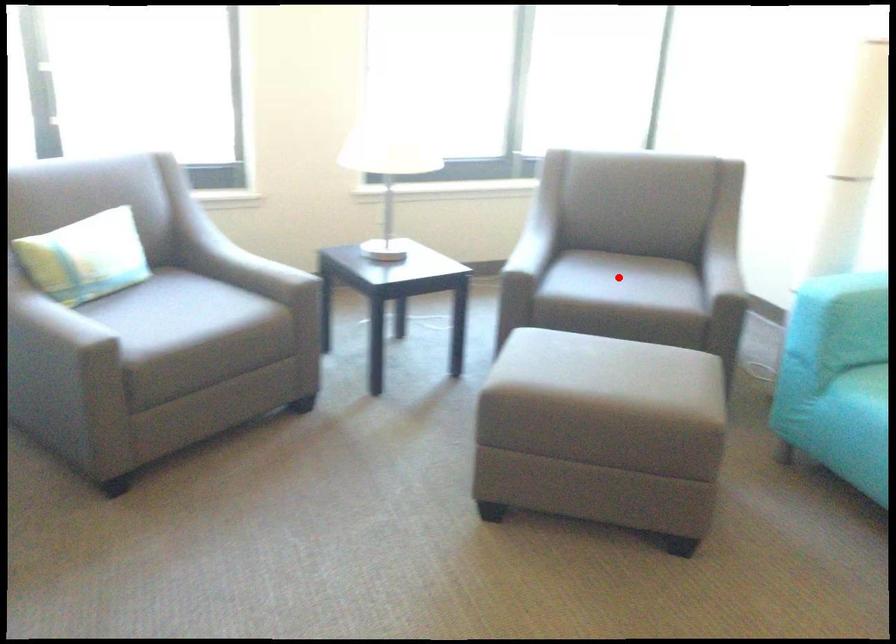
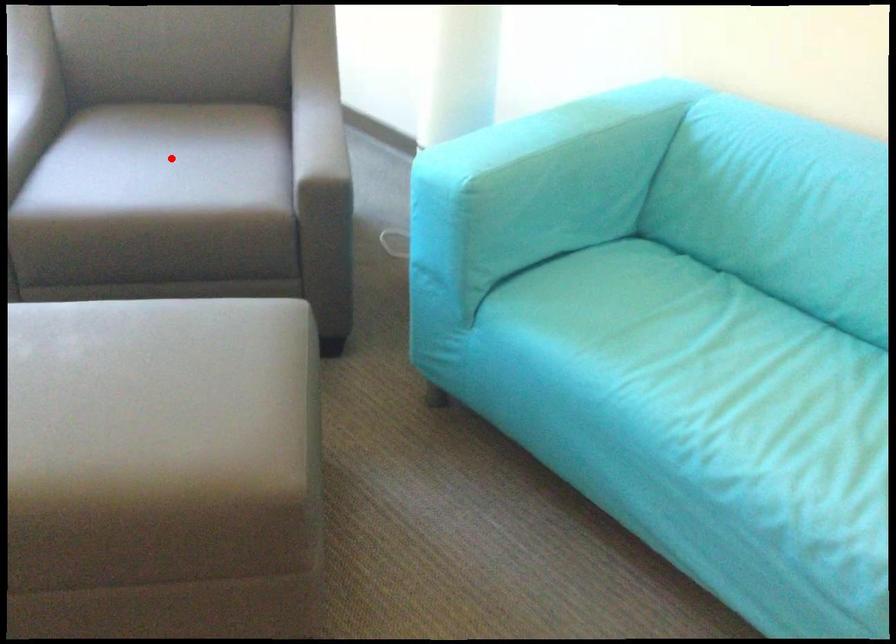
I am providing you with two images of the same scene from different viewpoints. A red point is marked on the first image and another point is marked on the second image. Do the highlighted points in image1 and image2 indicate the same real-world spot?

Yes